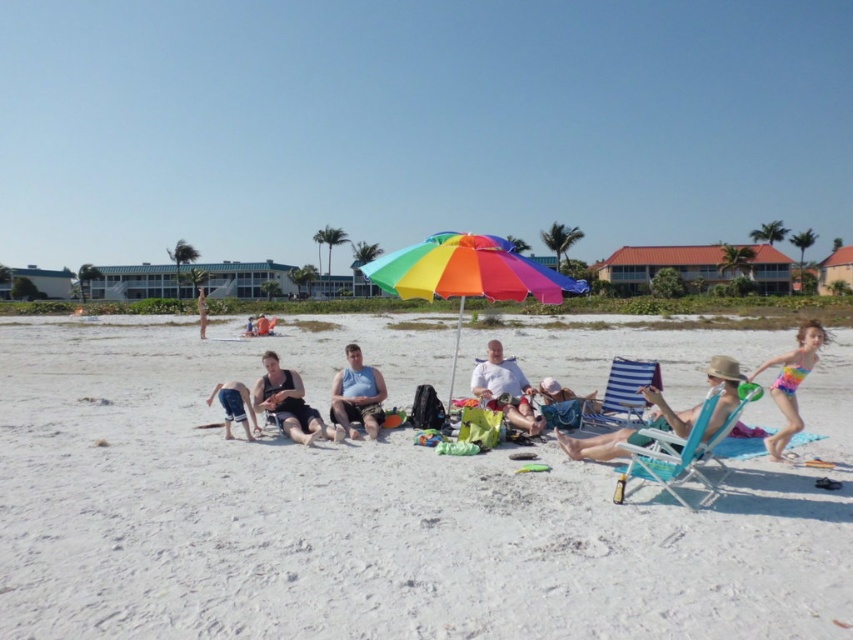
Can you confirm if rainbow fabric umbrella at center is wider than matte blue shorts at center?

Yes, rainbow fabric umbrella at center is wider than matte blue shorts at center.

Does rainbow fabric umbrella at center have a greater height compared to matte blue shorts at center?

Correct, rainbow fabric umbrella at center is much taller as matte blue shorts at center.

Does point (457, 348) come behind point (500, 381)?

Yes, it is.

Where is `rainbow fabric umbrella at center`? Image resolution: width=853 pixels, height=640 pixels. rainbow fabric umbrella at center is located at coordinates (467, 273).

Is beige straw hat at center shorter than matte black shorts at center?

In fact, beige straw hat at center may be taller than matte black shorts at center.

Can you confirm if beige straw hat at center is positioned below matte black shorts at center?

Yes, beige straw hat at center is below matte black shorts at center.

Does point (610, 433) come in front of point (248, 332)?

Yes, it is in front of point (248, 332).

Identify the location of beige straw hat at center. The image size is (853, 640). pos(601,444).

Is teal fabric beach chair at center bigger than rainbow swimsuit at right?

No.

Is point (695, 419) positioned behind point (811, 321)?

That is False.

Locate an element on the screen. Image resolution: width=853 pixels, height=640 pixels. teal fabric beach chair at center is located at coordinates (682, 449).